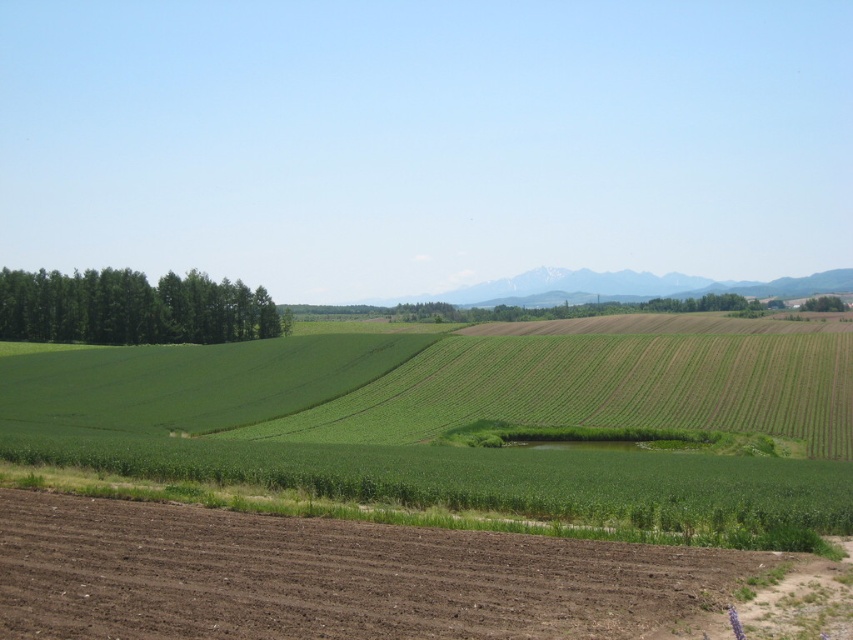
Question: Does green grassy field at center come in front of green leafy trees at left?

Choices:
 (A) yes
 (B) no

Answer: (A)

Question: Is brown soil at lower left wider than green leafy tree at right?

Choices:
 (A) yes
 (B) no

Answer: (B)

Question: Which is farther from the green leafy trees at left?

Choices:
 (A) brown soil at lower left
 (B) green leafy tree at right

Answer: (B)

Question: Which point is farther to the camera?

Choices:
 (A) (827, 305)
 (B) (647, 627)
 (C) (141, 294)

Answer: (A)

Question: Among these objects, which one is nearest to the camera?

Choices:
 (A) green leafy trees at left
 (B) brown soil at lower left
 (C) green grassy field at center

Answer: (B)

Question: Does green leafy trees at left lie in front of green leafy tree at right?

Choices:
 (A) no
 (B) yes

Answer: (B)